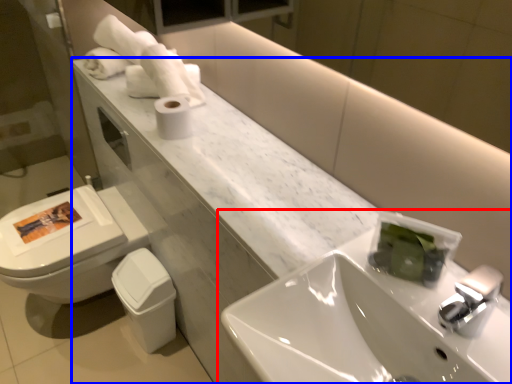
Question: Which of the following is the farthest to the observer, sink (highlighted by a red box) or counter (highlighted by a blue box)?

Choices:
 (A) sink
 (B) counter

Answer: (B)